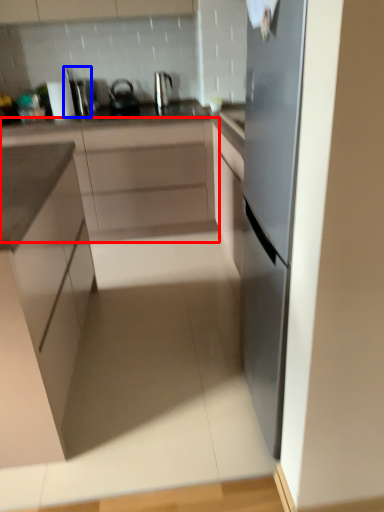
Question: Among these objects, which one is farthest to the camera, cabinetry (highlighted by a red box) or appliance (highlighted by a blue box)?

Choices:
 (A) cabinetry
 (B) appliance

Answer: (B)